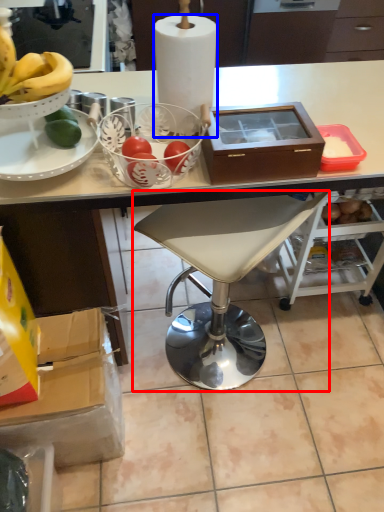
Question: Among these objects, which one is nearest to the camera, chair (highlighted by a red box) or paper towel (highlighted by a blue box)?

Choices:
 (A) chair
 (B) paper towel

Answer: (B)